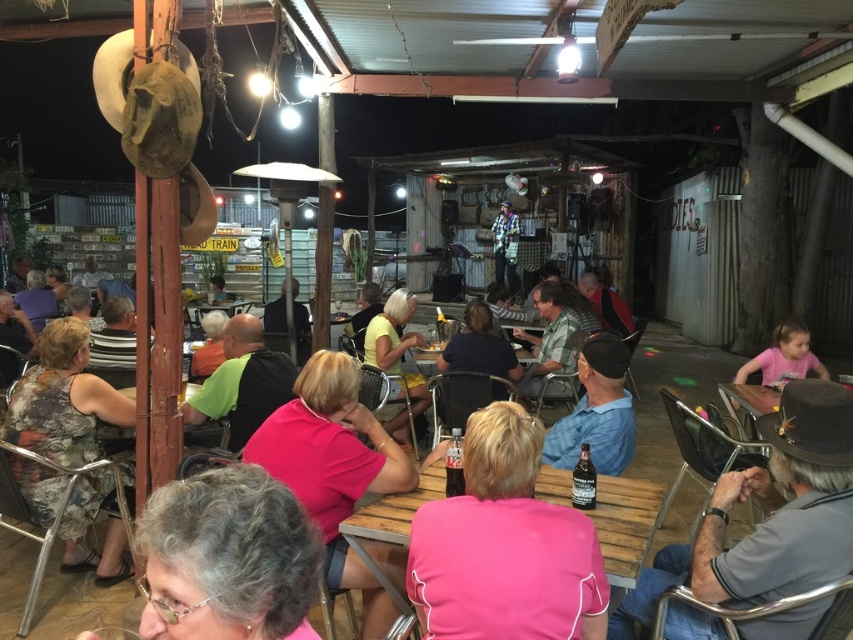
How distant is wooden table at center from yellow fabric shirt at center?

wooden table at center and yellow fabric shirt at center are 8.90 feet apart.

Is wooden table at center above yellow fabric shirt at center?

No.

Does point (653, 483) lie in front of point (383, 333)?

That is True.

Locate an element on the screen. This screenshot has height=640, width=853. wooden table at center is located at coordinates (625, 524).

Which of these two, pink matte shirt at center or wooden table at center, stands shorter?

wooden table at center

Who is taller, pink matte shirt at center or wooden table at center?

pink matte shirt at center is taller.

Is point (378, 424) positioned in front of point (645, 493)?

That is False.

The image size is (853, 640). I want to click on pink matte shirt at center, so click(x=334, y=468).

How distant is blue fabric shirt at center from green matte shirt at center?

blue fabric shirt at center and green matte shirt at center are 1.59 meters apart from each other.

Is point (624, 365) farther from camera compared to point (206, 394)?

No, it is in front of (206, 394).

Identify the location of blue fabric shirt at center. (596, 410).